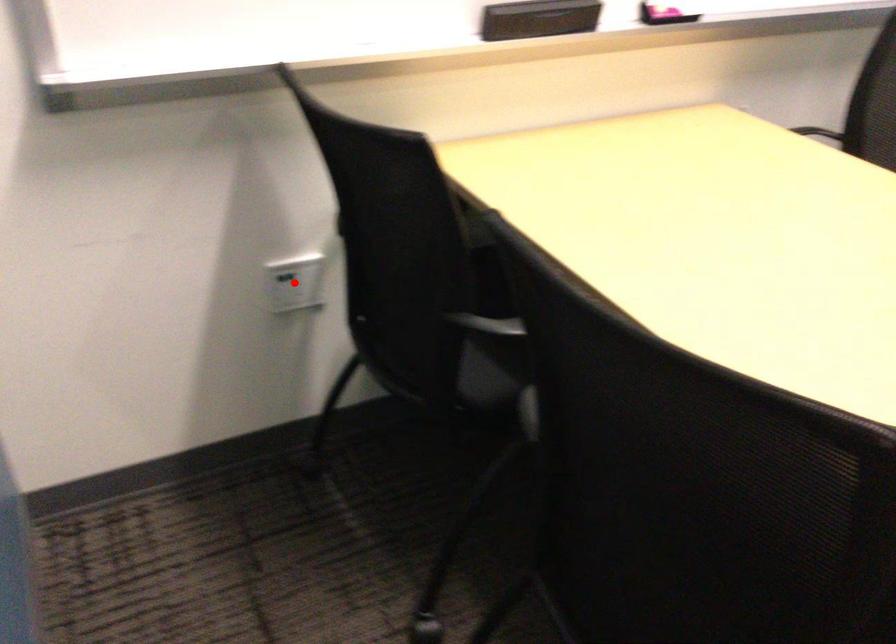
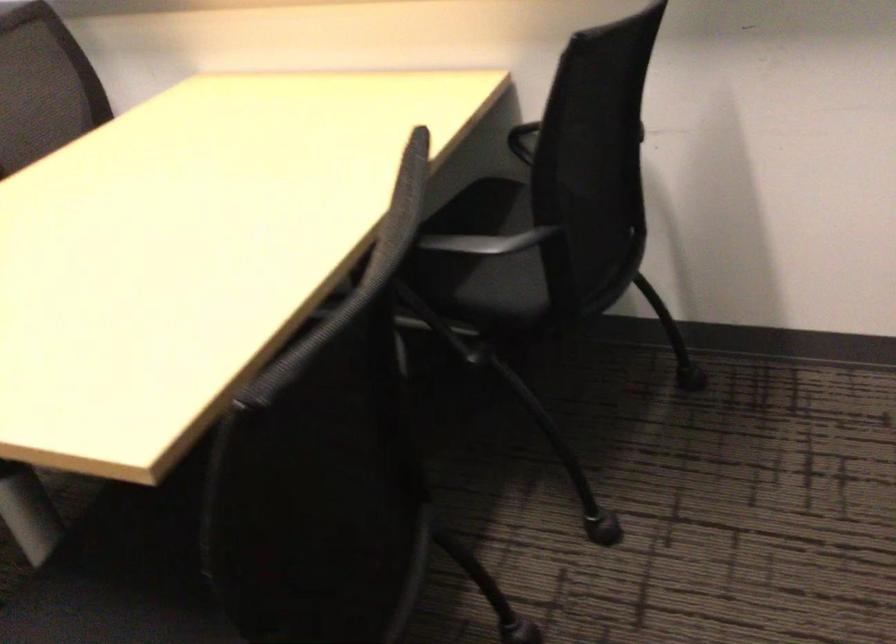
Question: I am providing you with two images of the same scene from different viewpoints. A red point is marked on the first image. Can you still see the location of the red point in image 2?

Choices:
 (A) Yes
 (B) No

Answer: (B)